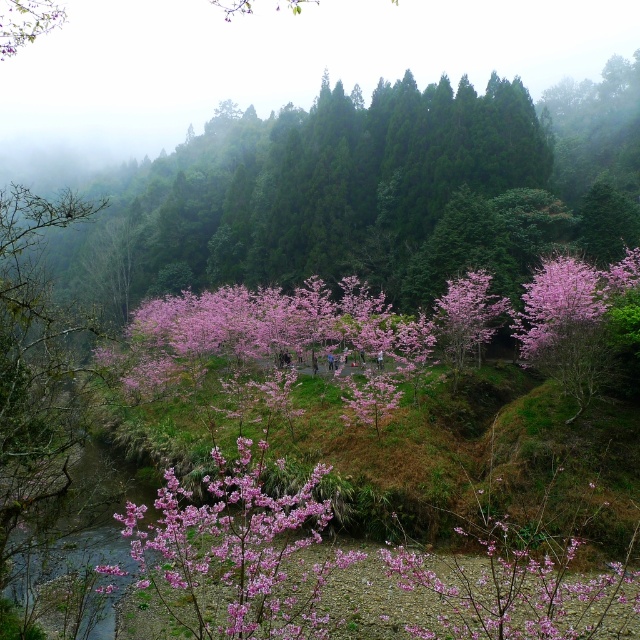
Question: Is pink matte flowers at center wider than pink matte flower at center?

Choices:
 (A) no
 (B) yes

Answer: (B)

Question: Is pink matte flowers at center smaller than pink matte flower at center?

Choices:
 (A) yes
 (B) no

Answer: (B)

Question: Can you confirm if pink matte flowers at center is positioned below pink matte flower at center?

Choices:
 (A) yes
 (B) no

Answer: (A)

Question: Which of the following is the farthest from the observer?

Choices:
 (A) (x=518, y=566)
 (B) (x=182, y=547)

Answer: (A)